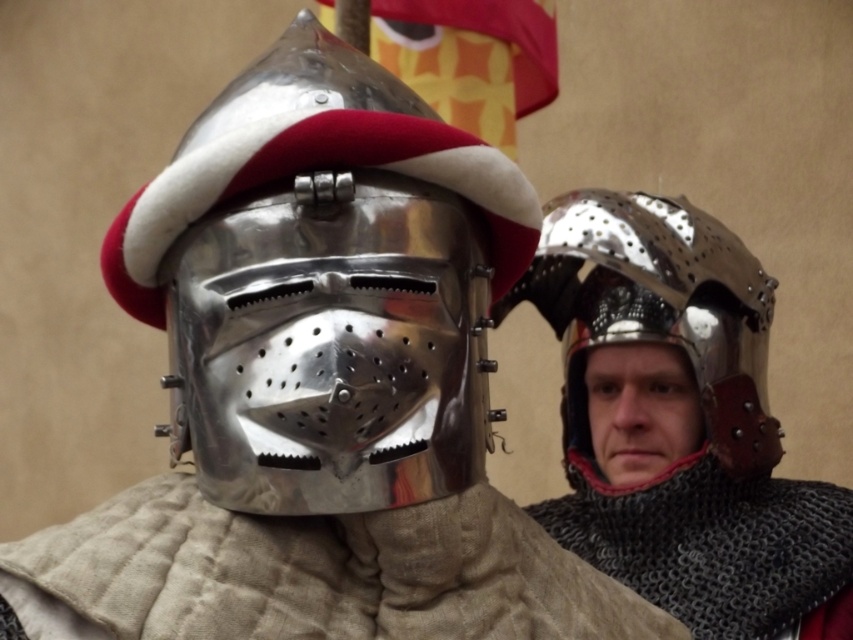
Question: Which object appears farthest from the camera in this image?

Choices:
 (A) shiny metallic helmet at right
 (B) shiny metallic helmet at center

Answer: (A)

Question: Can you confirm if shiny metallic helmet at center is thinner than shiny metallic helmet at right?

Choices:
 (A) no
 (B) yes

Answer: (B)

Question: Is shiny metallic helmet at center above shiny metallic helmet at right?

Choices:
 (A) no
 (B) yes

Answer: (B)

Question: Can you confirm if shiny metallic helmet at center is thinner than shiny metallic helmet at right?

Choices:
 (A) no
 (B) yes

Answer: (B)